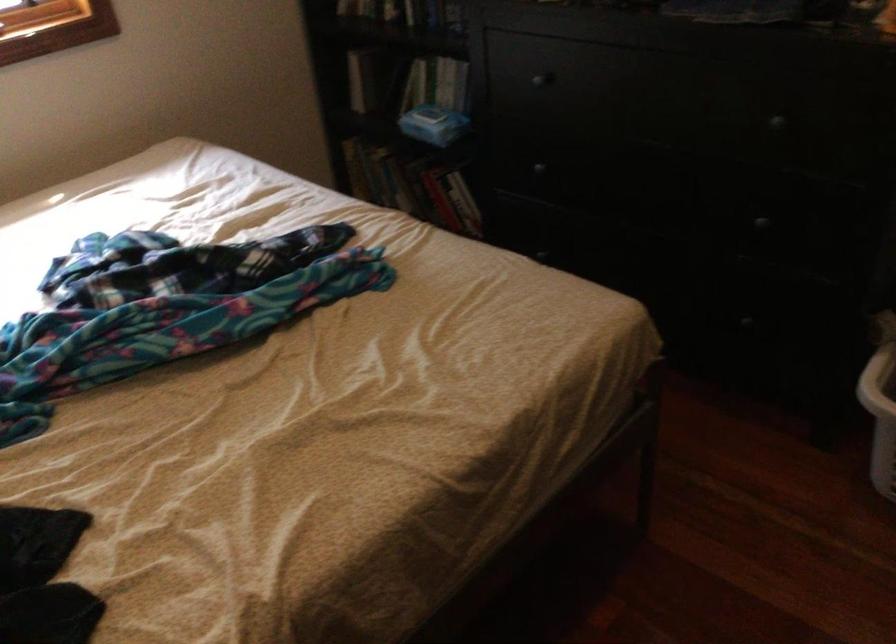
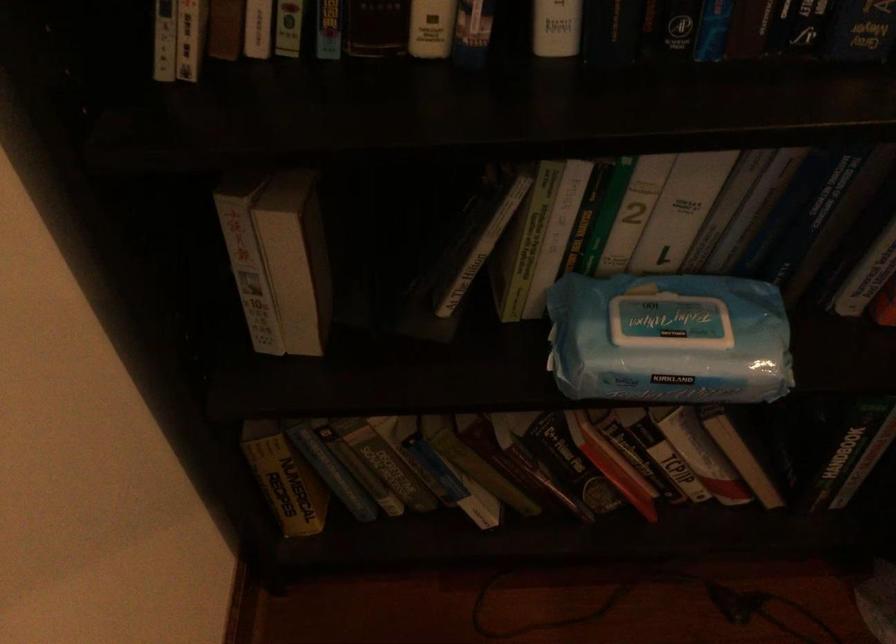
Locate, in the second image, the point that corresponds to [431,111] in the first image.

(673, 317)